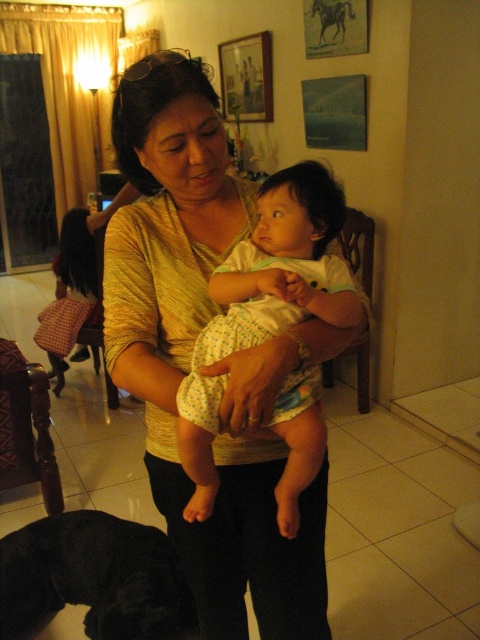
Question: Is the position of yellow textured blouse at center more distant than that of black fur dog at lower left?

Choices:
 (A) no
 (B) yes

Answer: (A)

Question: Among these points, which one is nearest to the camera?

Choices:
 (A) (291, 300)
 (B) (235, 116)
 (C) (173, 596)
 (D) (187, 273)

Answer: (A)

Question: Which point is closer to the camera?

Choices:
 (A) white dotted fabric baby at center
 (B) yellow textured blouse at center
 (C) wooden picture frame at upper center
 (D) black fur dog at lower left

Answer: (B)

Question: Does white dotted fabric baby at center have a greater width compared to black fur dog at lower left?

Choices:
 (A) no
 (B) yes

Answer: (A)

Question: Estimate the real-world distances between objects in this image. Which object is farther from the wooden picture frame at upper center?

Choices:
 (A) yellow textured blouse at center
 (B) white dotted fabric baby at center

Answer: (B)

Question: Is yellow textured blouse at center smaller than black fur dog at lower left?

Choices:
 (A) no
 (B) yes

Answer: (A)